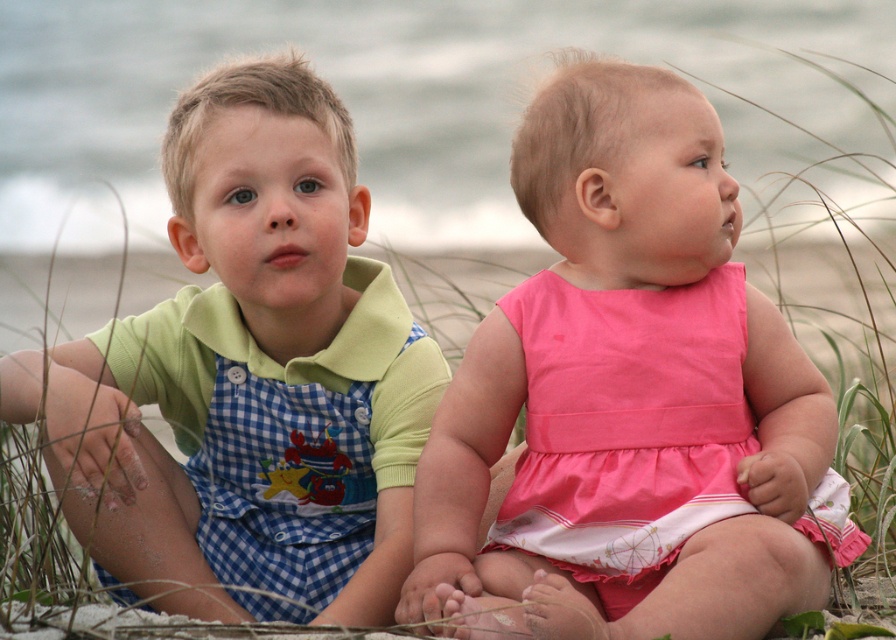
Does pink satin dress at center have a lesser width compared to checkered fabric overalls at left?

Indeed, pink satin dress at center has a lesser width compared to checkered fabric overalls at left.

Is pink satin dress at center wider than checkered fabric overalls at left?

Incorrect, pink satin dress at center's width does not surpass checkered fabric overalls at left's.

Find the location of `pink satin dress at center`. pink satin dress at center is located at coordinates (629, 397).